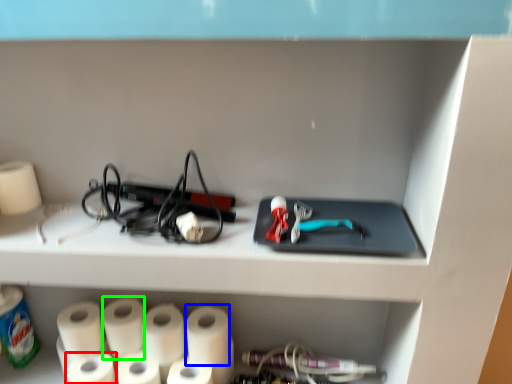
Question: Estimate the real-world distances between objects in this image. Which object is farther from toilet paper (highlighted by a red box), paper towel (highlighted by a blue box) or paper towel (highlighted by a green box)?

Choices:
 (A) paper towel
 (B) paper towel

Answer: (A)